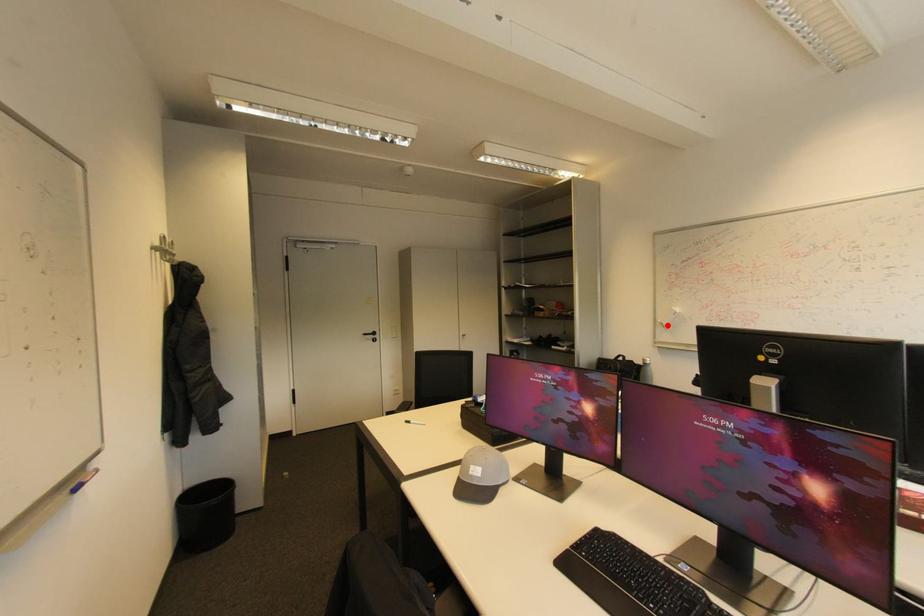
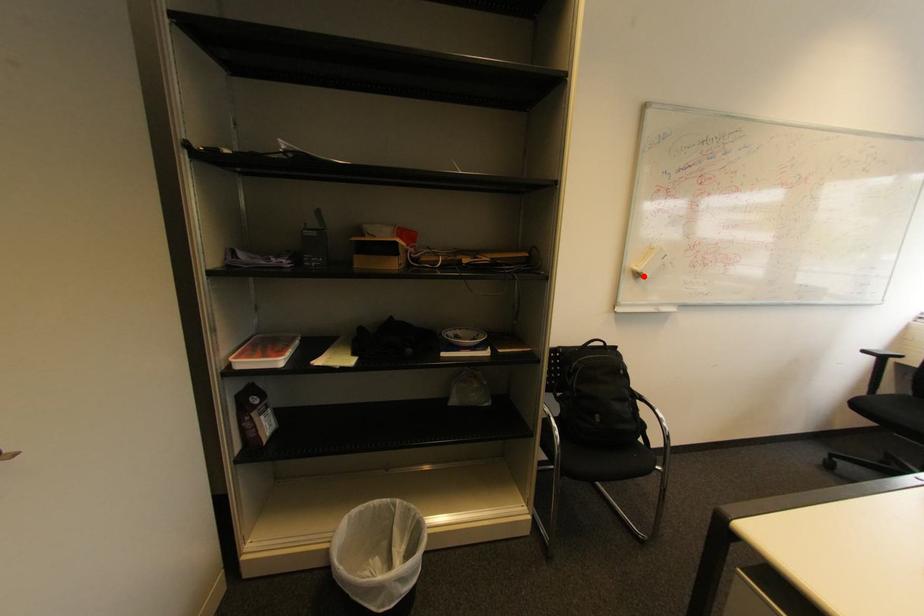
I am providing you with two images of the same scene from different viewpoints. A red point is marked on the first image and another point is marked on the second image. Is the red point in image1 aligned with the point shown in image2?

Yes